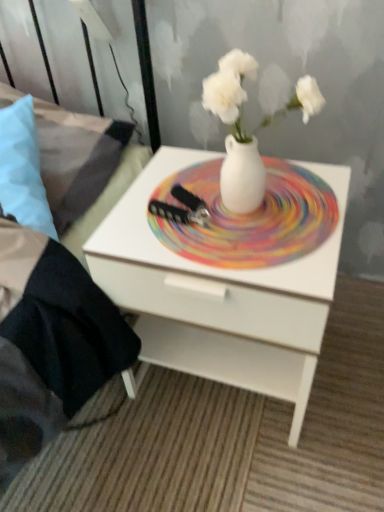
The width and height of the screenshot is (384, 512). Identify the location of free point above white glossy plate at center (from a real-world perspective). (246, 207).